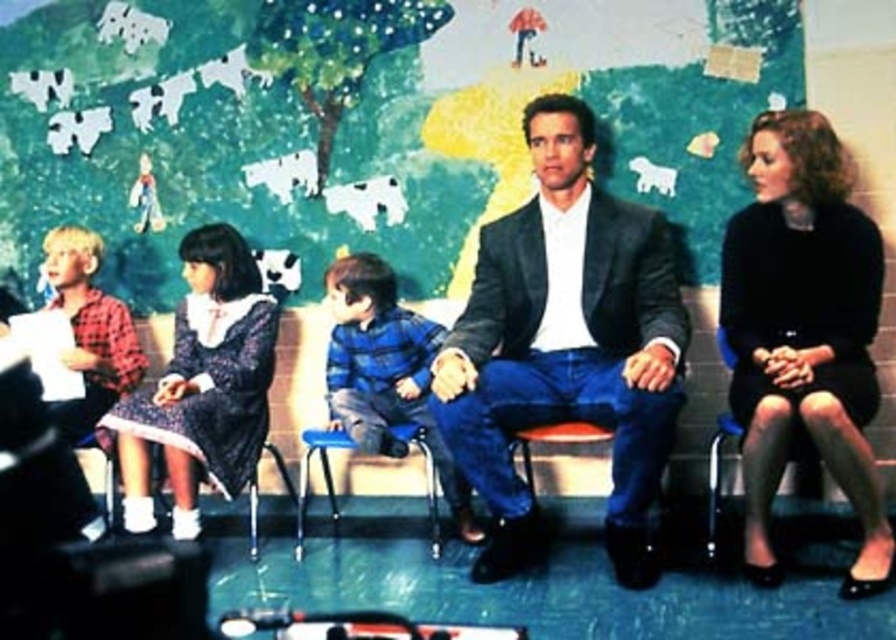
Is point (797, 305) less distant than point (358, 253)?

Yes, it is in front of point (358, 253).

Find the location of `black matte dress at right`. black matte dress at right is located at coordinates (804, 332).

Who is more distant from viewer, [725,317] or [359,412]?

The point [359,412] is more distant.

At what (x,y) coordinates should I click in order to perform the action: click on black matte dress at right. Please return your answer as a coordinate pair (x, y). Image resolution: width=896 pixels, height=640 pixels. Looking at the image, I should click on (804, 332).

Is point (403, 394) behind point (712, 544)?

Yes, it is behind point (712, 544).

Who is positioned more to the right, blue plaid shirt at center or black plastic chair at right?

From the viewer's perspective, black plastic chair at right appears more on the right side.

Locate an element on the screen. The image size is (896, 640). blue plaid shirt at center is located at coordinates (385, 372).

Does matte black suit at center have a lesser height compared to black matte dress at right?

In fact, matte black suit at center may be taller than black matte dress at right.

Can you confirm if matte black suit at center is smaller than black matte dress at right?

No, matte black suit at center is not smaller than black matte dress at right.

The height and width of the screenshot is (640, 896). I want to click on matte black suit at center, so click(x=565, y=344).